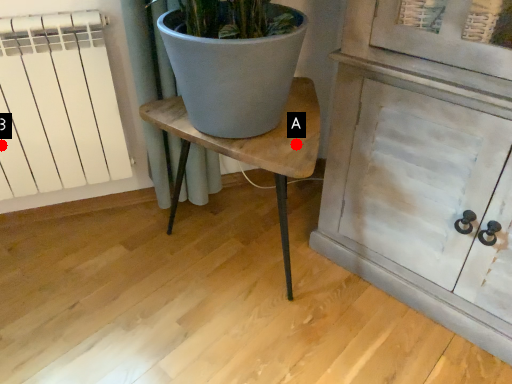
Question: Two points are circled on the image, labeled by A and B beside each circle. Which point is closer to the camera?

Choices:
 (A) A is closer
 (B) B is closer

Answer: (A)